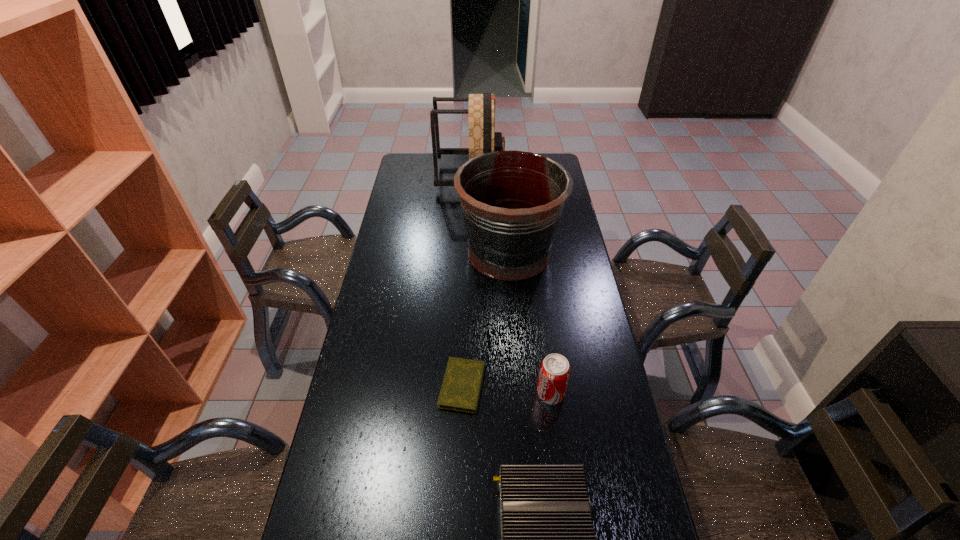
This screenshot has width=960, height=540. What are the coordinates of `free location that satisfies the following two spatial constraints: 1. on the front side of the diary; 2. on the left side of the third shortest object` in the screenshot? It's located at (463, 394).

This screenshot has height=540, width=960. I want to click on free space that satisfies the following two spatial constraints: 1. on the front side of the soda can; 2. on the right side of the fourth nearest object, so click(519, 394).